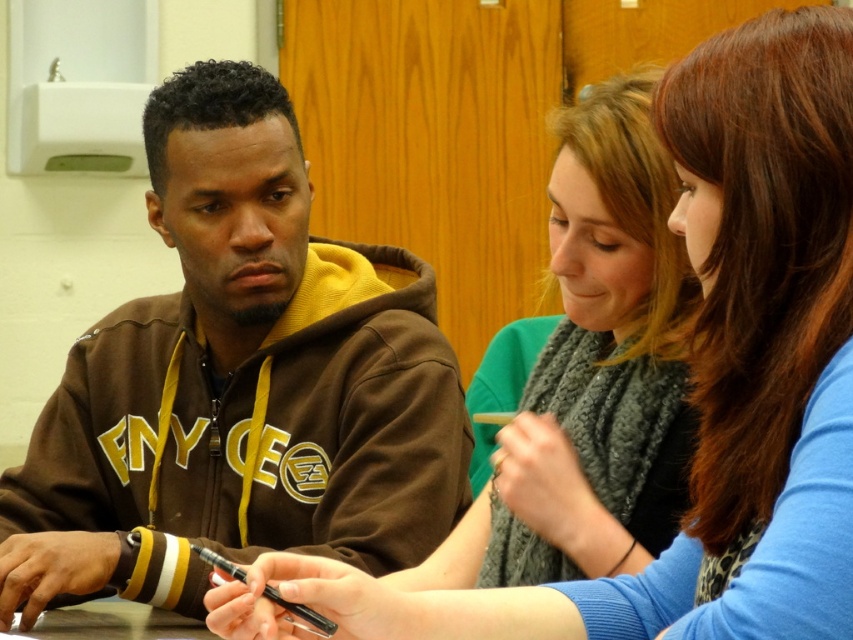
Question: In this image, where is brown fleece hoodie at left located relative to matte green sweater at center?

Choices:
 (A) left
 (B) right

Answer: (A)

Question: Can you confirm if brown fleece hoodie at left is smaller than matte green sweater at center?

Choices:
 (A) no
 (B) yes

Answer: (A)

Question: Among these objects, which one is nearest to the camera?

Choices:
 (A) matte green sweater at center
 (B) brown fleece hoodie at left

Answer: (A)

Question: Which point is closer to the camera?

Choices:
 (A) matte green sweater at center
 (B) brown fleece hoodie at left

Answer: (A)

Question: Does brown fleece hoodie at left have a greater width compared to matte green sweater at center?

Choices:
 (A) yes
 (B) no

Answer: (A)

Question: Among these objects, which one is nearest to the camera?

Choices:
 (A) matte green sweater at center
 (B) brown fleece hoodie at left

Answer: (A)